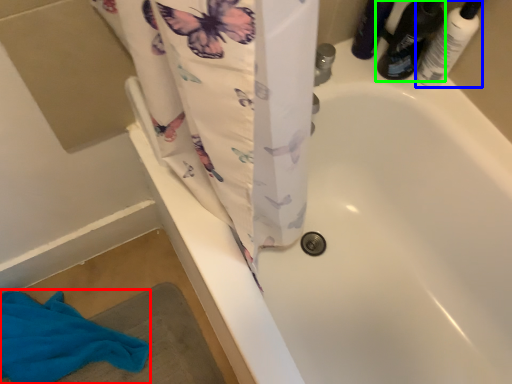
Question: Based on their relative distances, which object is nearer to beach towel (highlighted by a red box)? Choose from toiletry (highlighted by a blue box) and footwear (highlighted by a green box).

Choices:
 (A) toiletry
 (B) footwear

Answer: (B)